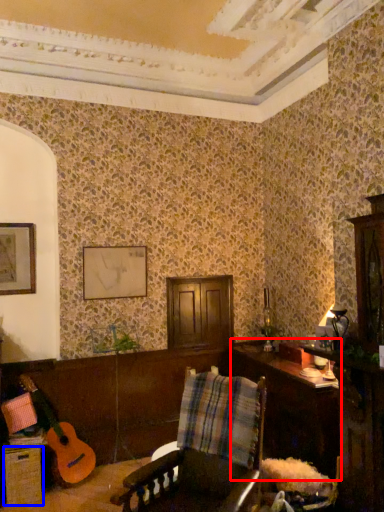
Question: Among these objects, which one is farthest to the camera, table (highlighted by a red box) or drawer (highlighted by a blue box)?

Choices:
 (A) table
 (B) drawer

Answer: (B)